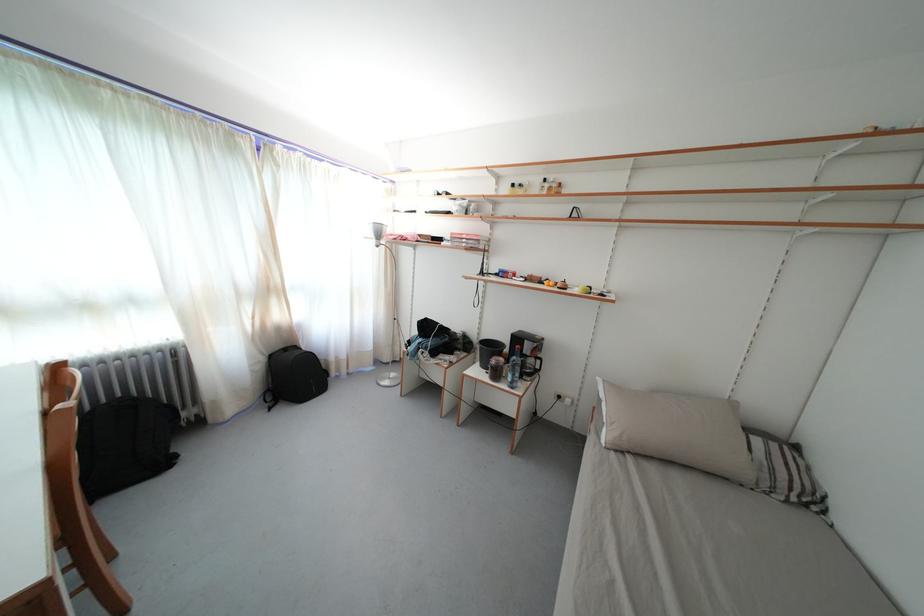
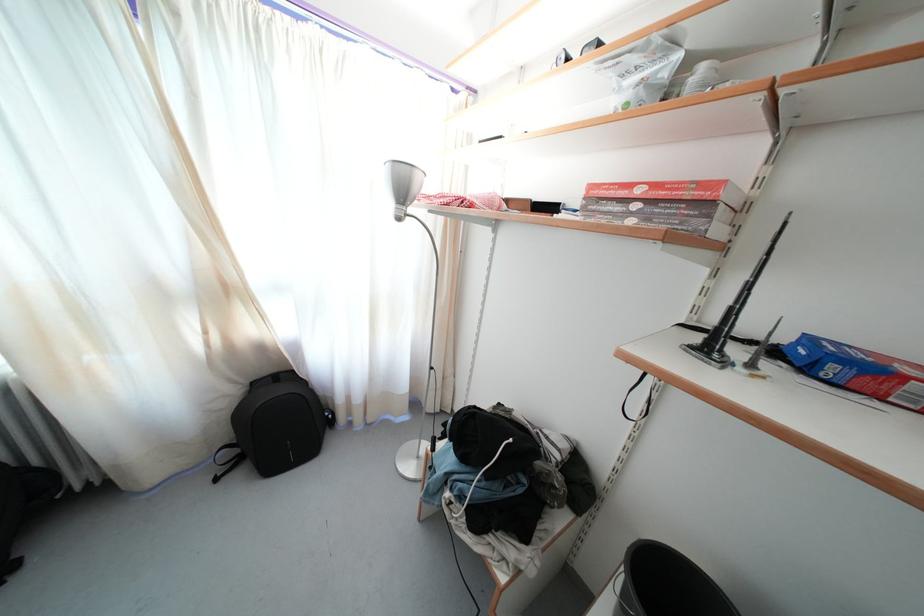
The point at (276, 362) is marked in the first image. Where is the corresponding point in the second image?

(259, 390)